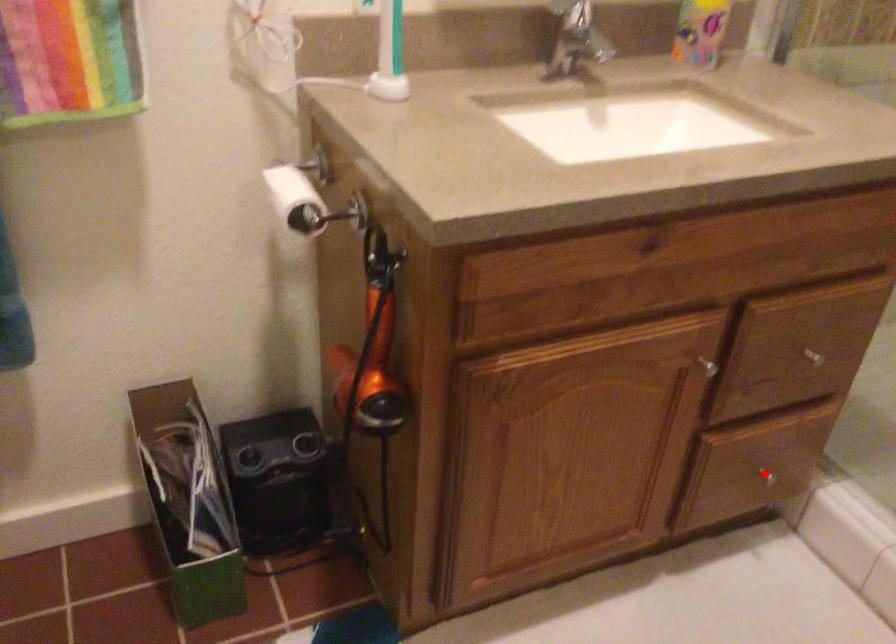
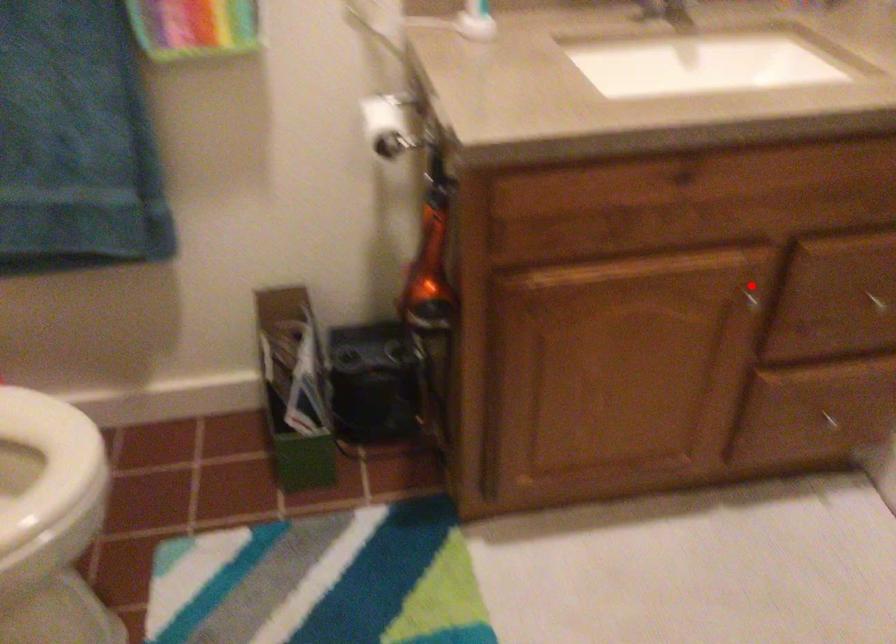
In the scene shown: I am providing you with two images of the same scene from different viewpoints. A red point is marked on the first image and another point is marked on the second image. Are the points marked in image1 and image2 representing the same 3D position?

No